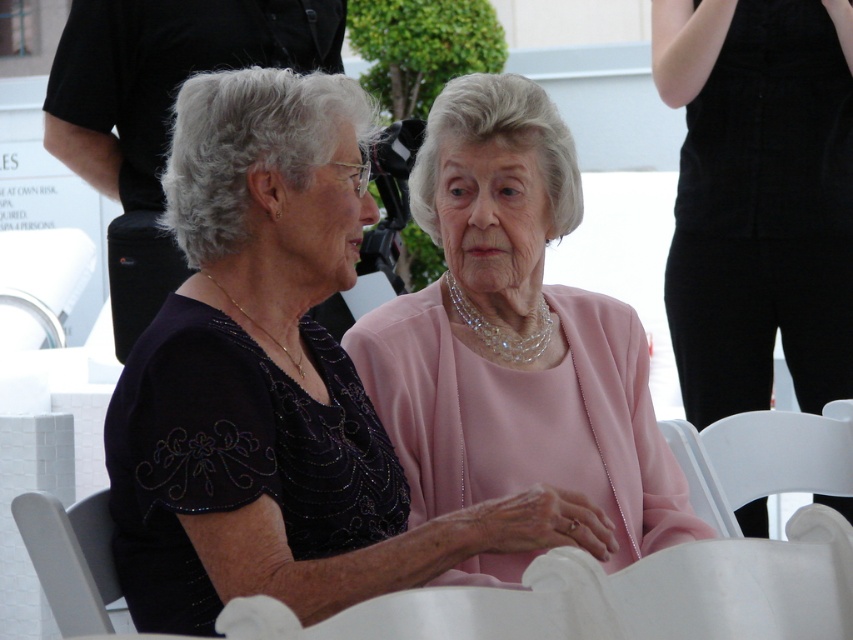
Question: Which point is farther to the camera?

Choices:
 (A) (44, 554)
 (B) (799, 4)
 (C) (712, 451)

Answer: (B)

Question: Considering the relative positions of matte black dress at center and white plastic chair at lower right in the image provided, where is matte black dress at center located with respect to white plastic chair at lower right?

Choices:
 (A) above
 (B) below

Answer: (A)

Question: Can you confirm if black satin dress at center is wider than white plastic chair at lower left?

Choices:
 (A) no
 (B) yes

Answer: (B)

Question: Considering the relative positions of pink satin dress at center and white plastic chair at lower left in the image provided, where is pink satin dress at center located with respect to white plastic chair at lower left?

Choices:
 (A) left
 (B) right

Answer: (B)

Question: Among these points, which one is farthest from the camera?

Choices:
 (A) (711, 86)
 (B) (769, 433)

Answer: (A)

Question: Which of these objects is positioned farthest from the matte black dress at center?

Choices:
 (A) pink satin dress at center
 (B) white plastic chair at lower left
 (C) black satin dress at center
 (D) white plastic chair at lower right

Answer: (C)